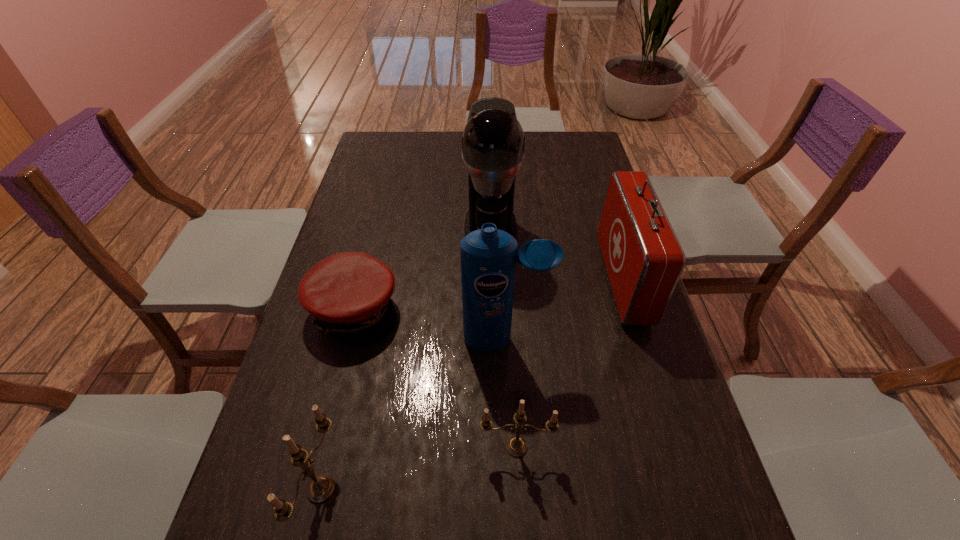
This screenshot has height=540, width=960. In order to click on vacant space at the far right corner of the desktop in this screenshot , I will do `click(562, 149)`.

Locate an element on the screen. vacant region between the shampoo and the cap is located at coordinates (430, 325).

The image size is (960, 540). In order to click on free space between the shorter candle and the fifth shortest object in this screenshot , I will do 511,393.

What are the coordinates of `vacant area between the cap and the second tallest object` in the screenshot? It's located at (430, 325).

The width and height of the screenshot is (960, 540). In order to click on vacant area that lies between the right candle and the shortest object in this screenshot , I will do [435, 379].

Where is `object that can be found as the fourth closest to the cap`? object that can be found as the fourth closest to the cap is located at coordinates (516, 446).

Find the location of a particular element. object that can be found as the closest to the third tallest object is located at coordinates (488, 256).

Where is `free space that satisfies the following two spatial constraints: 1. at the front of the fifth tallest object where the visor is located; 2. on the right side of the shortest object`? free space that satisfies the following two spatial constraints: 1. at the front of the fifth tallest object where the visor is located; 2. on the right side of the shortest object is located at coordinates (319, 447).

The width and height of the screenshot is (960, 540). I want to click on free location that satisfies the following two spatial constraints: 1. place cup under the spout of the coffee maker; 2. on the right side of the shorter candle, so click(x=496, y=447).

This screenshot has height=540, width=960. Find the location of `free point that satisfies the following two spatial constraints: 1. on the front side of the fifth tallest object; 2. on the left side of the fifth shortest object`. free point that satisfies the following two spatial constraints: 1. on the front side of the fifth tallest object; 2. on the left side of the fifth shortest object is located at coordinates (511, 447).